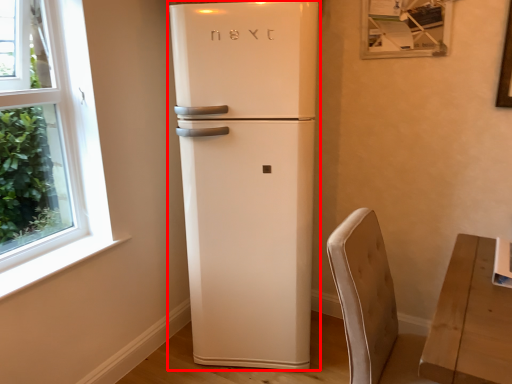
Question: Considering the relative positions of refrigerator (annotated by the red box) and armchair in the image provided, where is refrigerator (annotated by the red box) located with respect to the staircase?

Choices:
 (A) left
 (B) right

Answer: (A)